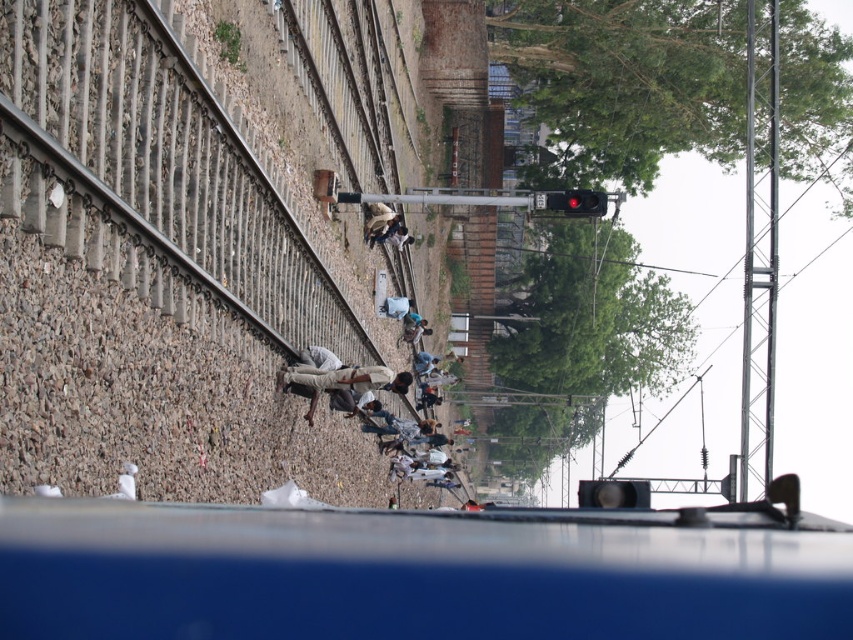
Who is positioned more to the left, light blue fabric at center or blue fabric shirt at center?

light blue fabric at center is more to the left.

Image resolution: width=853 pixels, height=640 pixels. What do you see at coordinates (398, 307) in the screenshot?
I see `light blue fabric at center` at bounding box center [398, 307].

Which is in front, point (405, 316) or point (426, 371)?

Positioned in front is point (405, 316).

Find the location of a particular element. This screenshot has height=640, width=853. light blue fabric at center is located at coordinates (398, 307).

Which is more to the right, red glass traffic light at upper center or light blue fabric at center?

red glass traffic light at upper center is more to the right.

This screenshot has width=853, height=640. What do you see at coordinates (576, 202) in the screenshot?
I see `red glass traffic light at upper center` at bounding box center [576, 202].

Is point (596, 193) in front of point (398, 301)?

Yes, point (596, 193) is in front of point (398, 301).

This screenshot has height=640, width=853. Identify the location of red glass traffic light at upper center. (576, 202).

Consider the image. Is black plastic traffic light at center closer to the viewer compared to light blue fabric at center?

Yes, it is.

Describe the element at coordinates (613, 493) in the screenshot. I see `black plastic traffic light at center` at that location.

Find the location of `black plastic traffic light at center`. black plastic traffic light at center is located at coordinates (613, 493).